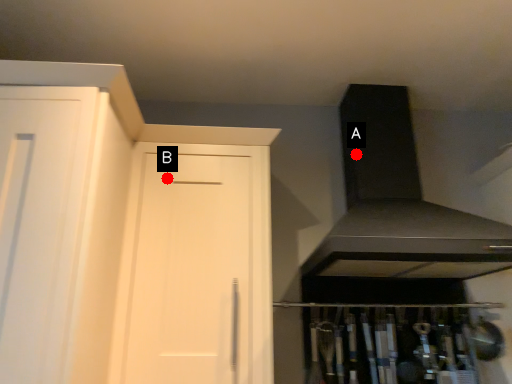
Question: Two points are circled on the image, labeled by A and B beside each circle. Which point is closer to the camera taking this photo?

Choices:
 (A) A is closer
 (B) B is closer

Answer: (B)